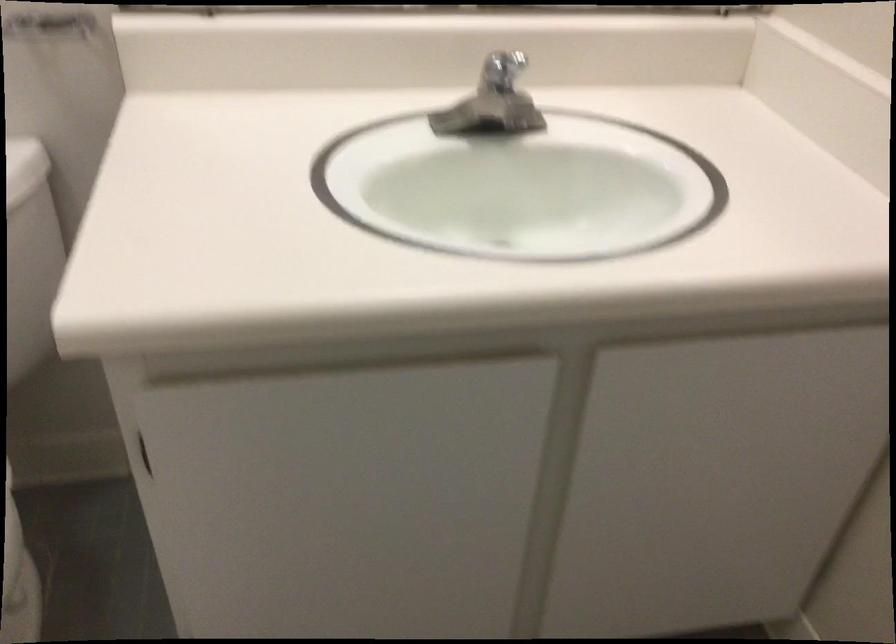
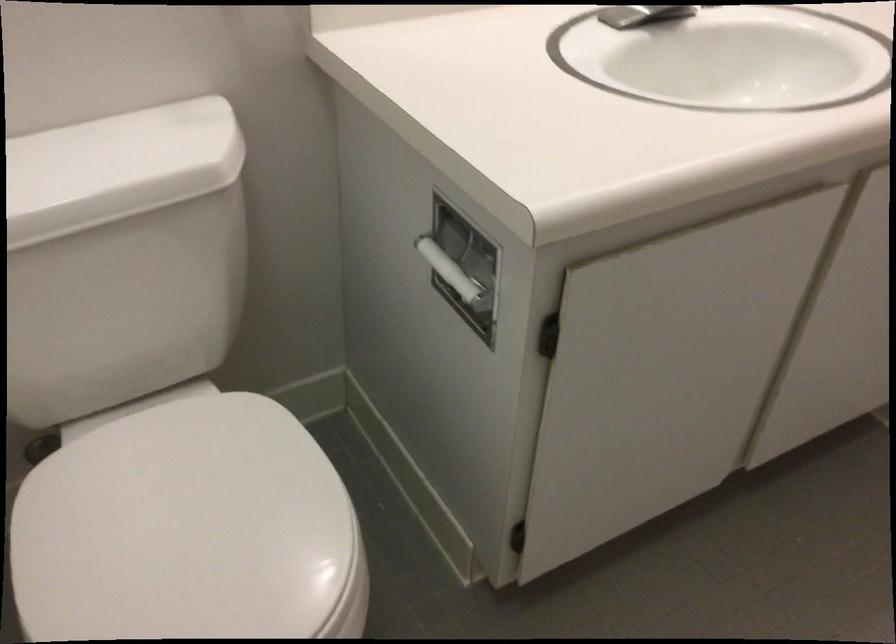
Question: The camera is either moving clockwise (left) or counter-clockwise (right) around the object. The first image is from the beginning of the video and the second image is from the end. Is the camera moving left or right when shooting the video?

Choices:
 (A) Left
 (B) Right

Answer: (A)